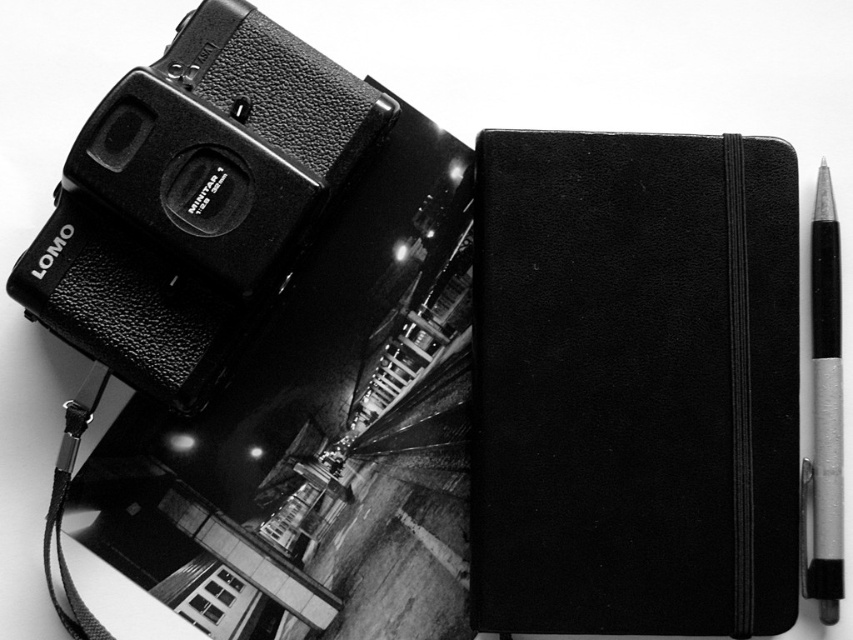
Identify the location of black leather notebook at center. (634, 385).

Can you confirm if black leather notebook at center is positioned below rubberized black camera at upper left?

Yes, black leather notebook at center is below rubberized black camera at upper left.

Locate an element on the screen. This screenshot has height=640, width=853. black leather notebook at center is located at coordinates point(634,385).

Does rubberized black camera at upper left appear on the right side of metallic silver pen at right?

No, rubberized black camera at upper left is not to the right of metallic silver pen at right.

Is rubberized black camera at upper left wider than metallic silver pen at right?

Yes, rubberized black camera at upper left is wider than metallic silver pen at right.

Identify the location of rubberized black camera at upper left. (195, 198).

Is black leather notebook at center taller than metallic silver pen at right?

Yes.

Does black leather notebook at center have a larger size compared to metallic silver pen at right?

Correct, black leather notebook at center is larger in size than metallic silver pen at right.

The height and width of the screenshot is (640, 853). I want to click on black leather notebook at center, so click(634, 385).